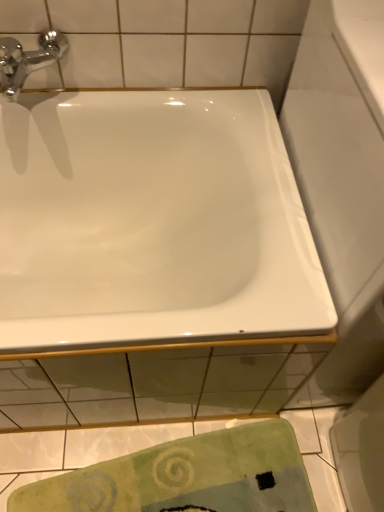
Question: Considering the positions of point click(x=241, y=424) and point click(x=66, y=158), is point click(x=241, y=424) closer or farther from the camera than point click(x=66, y=158)?

Choices:
 (A) farther
 (B) closer

Answer: (B)

Question: From their relative heights in the image, would you say green textured towel at lower center is taller or shorter than white glossy bathtub at upper center?

Choices:
 (A) short
 (B) tall

Answer: (A)

Question: Based on their relative distances, which object is nearer to the green textured towel at lower center?

Choices:
 (A) chrome/metallic faucet at upper left
 (B) white glossy bathtub at upper center

Answer: (B)

Question: Which object is the closest to the white glossy bathtub at upper center?

Choices:
 (A) green textured towel at lower center
 (B) chrome/metallic faucet at upper left

Answer: (B)